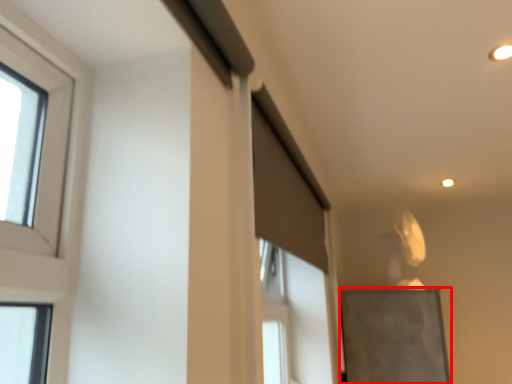
Question: Observing the image, what is the correct spatial positioning of bulletin board (annotated by the red box) in reference to screen door?

Choices:
 (A) left
 (B) right

Answer: (B)